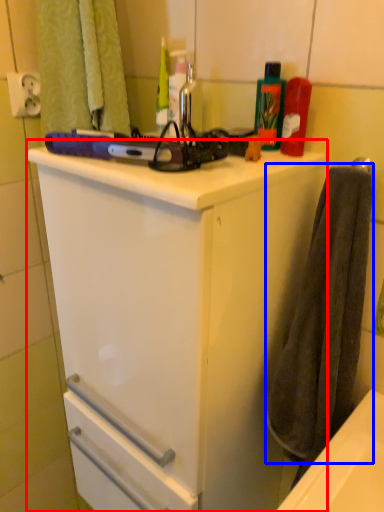
Question: Which of the following is the closest to the observer, bathroom cabinet (highlighted by a red box) or bath towel (highlighted by a blue box)?

Choices:
 (A) bathroom cabinet
 (B) bath towel

Answer: (A)